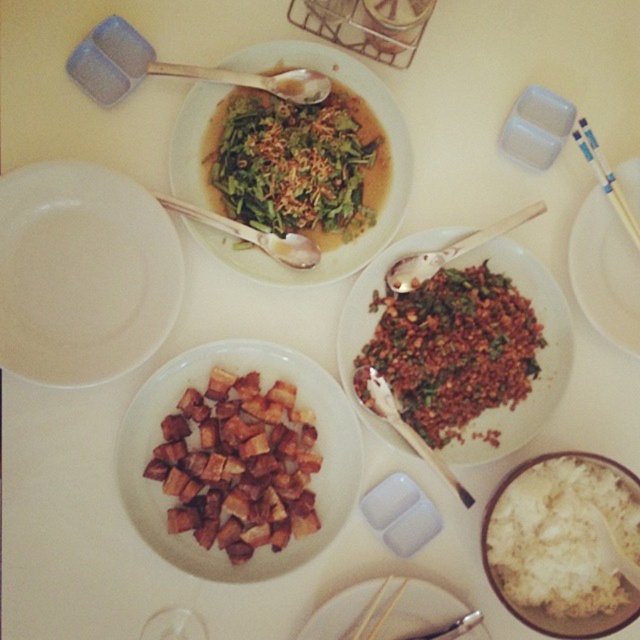
Question: From the image, what is the correct spatial relationship of white fluffy rice at bottom right in relation to brushed metal spoon at upper center?

Choices:
 (A) left
 (B) right

Answer: (B)

Question: Among these objects, which one is nearest to the camera?

Choices:
 (A) white matte plate at upper left
 (B) white plastic chopsticks at upper right
 (C) silver spoon at center
 (D) white fluffy rice at bottom right

Answer: (A)

Question: Is wooden fork at center below brushed metal spoon at upper center?

Choices:
 (A) no
 (B) yes

Answer: (A)

Question: Which point is closer to the camera taking this photo?

Choices:
 (A) (291, 243)
 (B) (296, 97)
 (C) (243, 556)

Answer: (C)

Question: Is white matte plate at upper left bigger than wooden spoon at upper center?

Choices:
 (A) no
 (B) yes

Answer: (B)

Question: Based on their relative distances, which object is nearer to the green leafymaterial/texture at center?

Choices:
 (A) white fluffy rice at bottom right
 (B) silver spoon at center
 (C) wooden fork at center
 (D) brown crispy cubes at center

Answer: (B)